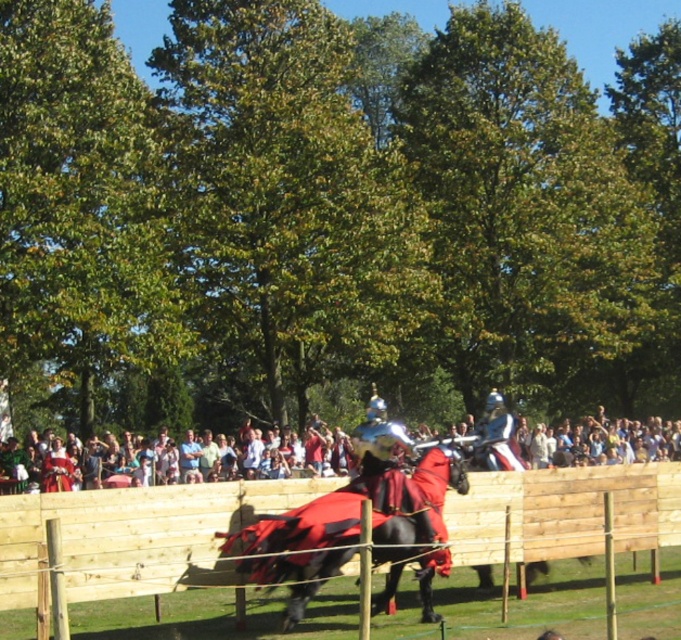
Can you confirm if white cotton shirt at center is positioned to the right of shiny red fabric horse at center?

Yes, white cotton shirt at center is to the right of shiny red fabric horse at center.

Between point (618, 461) and point (247, 563), which one is positioned behind?

Point (618, 461)

Between point (599, 433) and point (242, 544), which one is positioned in front?

Point (242, 544) is in front.

Where is `white cotton shirt at center`? white cotton shirt at center is located at coordinates (570, 444).

Does point (612, 484) come behind point (381, 524)?

Yes, point (612, 484) is behind point (381, 524).

Which is in front, point (22, 515) or point (306, 525)?

Point (22, 515) is more forward.

Does point (458, 497) come behind point (419, 538)?

That is True.

This screenshot has width=681, height=640. In order to click on wooden at center in this screenshot , I will do `click(133, 536)`.

Looking at this image, is wooden at center smaller than white cotton shirt at center?

Yes.

Is wooden at center taller than white cotton shirt at center?

Incorrect, wooden at center's height is not larger of white cotton shirt at center's.

Locate an element on the screen. Image resolution: width=681 pixels, height=640 pixels. wooden at center is located at coordinates (133, 536).